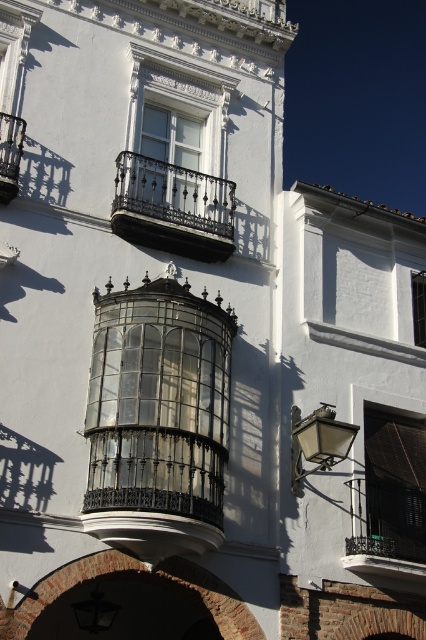
Is point (158, 401) positioned behind point (190, 252)?

No.

Is point (201, 406) closer to viewer compared to point (150, 189)?

Yes, point (201, 406) is closer to viewer.

The height and width of the screenshot is (640, 426). Identify the location of clear glass bay window at center. (158, 406).

Can you confirm if clear glass bay window at center is wider than white glass window at upper center?

No, clear glass bay window at center is not wider than white glass window at upper center.

What do you see at coordinates (158, 406) in the screenshot? This screenshot has width=426, height=640. I see `clear glass bay window at center` at bounding box center [158, 406].

Locate an element on the screen. clear glass bay window at center is located at coordinates (158, 406).

Between point (215, 492) and point (368, 451), which one is positioned behind?

Positioned behind is point (368, 451).

The width and height of the screenshot is (426, 640). Describe the element at coordinates (158, 406) in the screenshot. I see `clear glass bay window at center` at that location.

Find the location of `clear glass bay window at center`. clear glass bay window at center is located at coordinates [x=158, y=406].